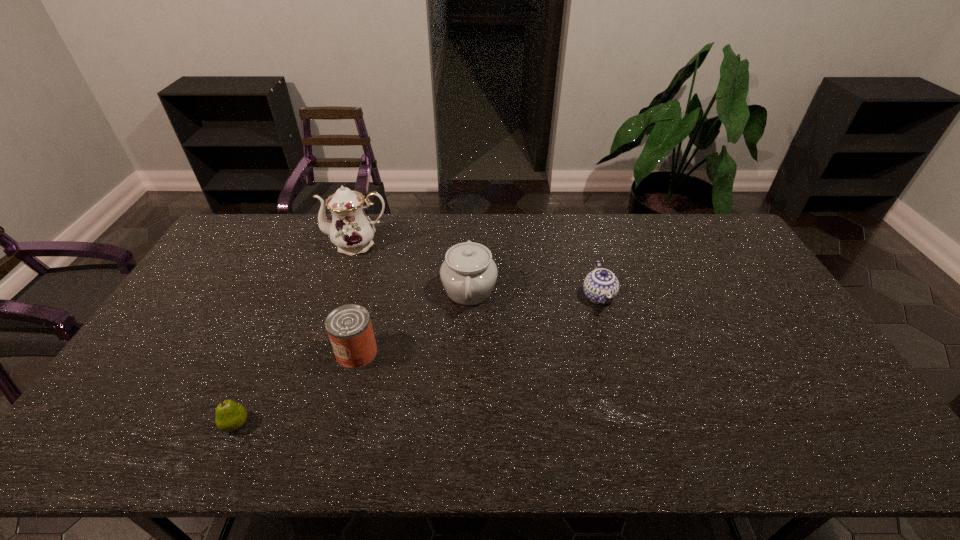
Identify the location of vacant space at the far left corner. Image resolution: width=960 pixels, height=540 pixels. (238, 223).

At what (x,y) coordinates should I click in order to perform the action: click on vacant space at the far right corner of the desktop. Please return your answer as a coordinate pair (x, y). The width and height of the screenshot is (960, 540). Looking at the image, I should click on tap(706, 228).

You are a GUI agent. You are given a task and a screenshot of the screen. Output one action in this format:
    pyautogui.click(x=<x>, y=<y>)
    Task: Click on the free space between the fourth farthest object and the tallest object
    The height and width of the screenshot is (540, 960).
    Given the screenshot: What is the action you would take?
    pyautogui.click(x=357, y=299)

Where is `vacant space that's between the fourth shortest object and the tallest object`? The height and width of the screenshot is (540, 960). vacant space that's between the fourth shortest object and the tallest object is located at coordinates (414, 267).

In order to click on vacant area that lies between the third tallest object and the farthest chinaware in this screenshot , I will do `click(357, 299)`.

Locate an element on the screen. This screenshot has height=540, width=960. vacant space in between the pear and the tallest object is located at coordinates (297, 334).

Locate an element on the screen. This screenshot has width=960, height=540. vacant region between the farthest object and the pear is located at coordinates (297, 334).

The height and width of the screenshot is (540, 960). I want to click on vacant point located between the second nearest object and the fourth object from left to right, so click(x=413, y=322).

Where is `vacant area between the rightmost object and the nearest object`? vacant area between the rightmost object and the nearest object is located at coordinates (418, 360).

Find the location of `object that can be found as the second closest to the rightmost chinaware`. object that can be found as the second closest to the rightmost chinaware is located at coordinates (349, 328).